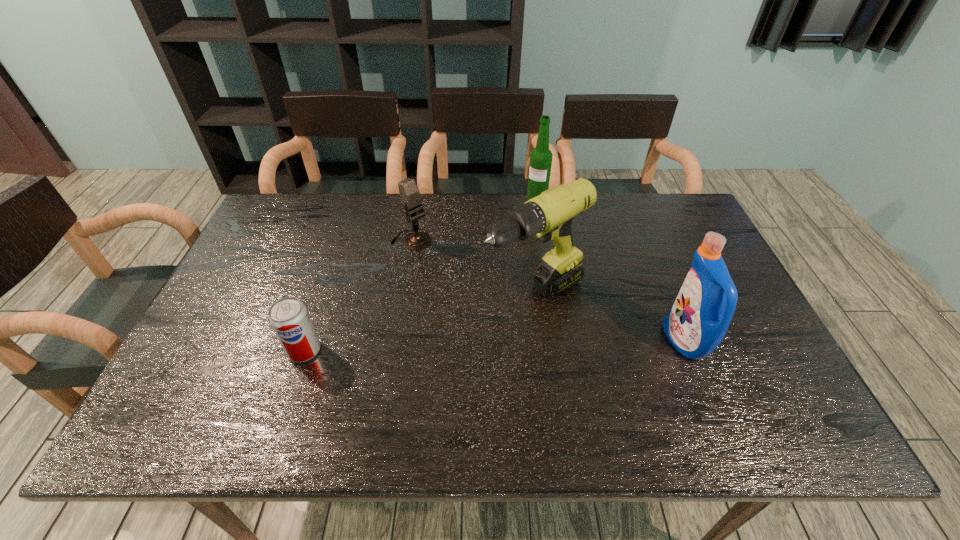
At what (x,y) coordinates should I click in order to perform the action: click on soda. Please return your answer as a coordinate pair (x, y). The image size is (960, 540). Looking at the image, I should click on (288, 317).

Identify the location of the shortest object. (288, 317).

I want to click on detergent, so [697, 322].

Find the location of a particular element. The image size is (960, 540). drill is located at coordinates (548, 216).

Identify the location of the fourth object from right to left. (409, 192).

Find the location of `the fourth tallest object`. the fourth tallest object is located at coordinates coord(409,192).

Where is `the farthest object`? This screenshot has width=960, height=540. the farthest object is located at coordinates (541, 157).

Where is `vacant region located on the right of the leftmost object`? vacant region located on the right of the leftmost object is located at coordinates (477, 350).

The image size is (960, 540). Identify the location of vacant region located on the label of the detergent. (607, 341).

Locate an element on the screen. free spot located 0.260m on the label of the detergent is located at coordinates (562, 341).